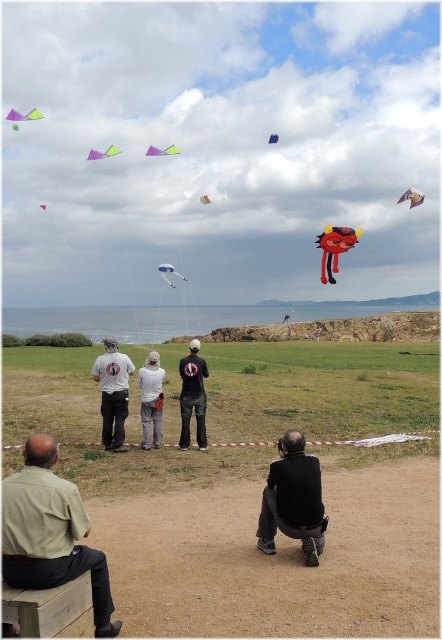
Question: Among these objects, which one is farthest from the camera?

Choices:
 (A) matte green kite at upper center
 (B) neon yellow plastic kite at upper left
 (C) white glossy kite at center

Answer: (A)

Question: Which point is closer to the camera taking this photo?

Choices:
 (A) (80, 566)
 (B) (320, 276)
 (C) (34, 116)

Answer: (A)

Question: Does white cotton shirt at center have a lesser width compared to matte green kite at upper center?

Choices:
 (A) no
 (B) yes

Answer: (B)

Question: Is neon yellow plastic kite at upper left positioned before matte green kite at center?

Choices:
 (A) no
 (B) yes

Answer: (A)

Question: Considering the real-world distances, which object is closest to the matte green kite at upper center?

Choices:
 (A) white cotton t-shirt at center
 (B) blue fabric kite at upper center
 (C) neon yellow plastic kite at upper left

Answer: (C)

Question: Does black matte shirt at center appear under white glossy kite at upper center?

Choices:
 (A) yes
 (B) no

Answer: (A)